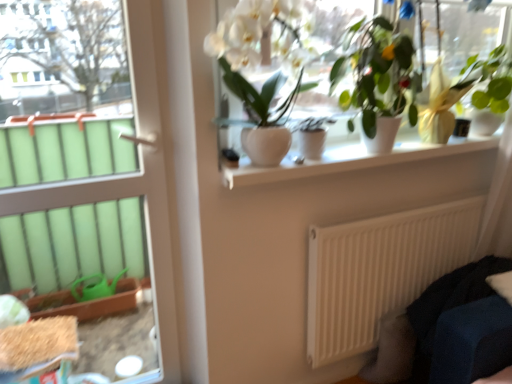
In order to face white matte radiator at lower right, should I rotate leftwards or rightwards?

You should rotate right by 20.667 degrees.

Find the location of a particular element. white matte radiator at lower right is located at coordinates (379, 271).

At what (x,y) coordinates should I click in order to perform the action: click on white glossy vase at upper center, which is counted as the 4th houseplant, starting from the right. Please return your answer as a coordinate pair (x, y). This screenshot has width=512, height=384. Looking at the image, I should click on (257, 65).

How much space does matte white pot at center, acting as the 3th houseplant starting from the right, occupy vertically?

5.70 inches.

The width and height of the screenshot is (512, 384). What do you see at coordinates (312, 136) in the screenshot? I see `matte white pot at center, the second houseplant in the left-to-right sequence` at bounding box center [312, 136].

At what (x,y) coordinates should I click in order to perform the action: click on white glossy door at left. Please return your answer as a coordinate pair (x, y). Looking at the image, I should click on (135, 176).

This screenshot has width=512, height=384. What are the coordinates of `dark blue fabric couch at lower right` in the screenshot? It's located at (428, 322).

Image resolution: width=512 pixels, height=384 pixels. Identify the location of green matte plant at upper center, arranged as the 2th houseplant when viewed from the right. (378, 80).

Locate an element on the screen. The image size is (512, 384). white matte radiator at lower right is located at coordinates (379, 271).

Consider the image. In the image, is matte white pot at center, the second houseplant in the left-to-right sequence, on the left side or the right side of white glossy door at left?

In the image, matte white pot at center, the second houseplant in the left-to-right sequence, appears on the right side of white glossy door at left.

From a real-world perspective, which is physically below, matte white pot at center, the second houseplant in the left-to-right sequence, or white glossy door at left?

white glossy door at left is physically lower.

Is matte white pot at center, the second houseplant in the left-to-right sequence, aimed at white glossy door at left?

No, matte white pot at center, the second houseplant in the left-to-right sequence, is not aimed at white glossy door at left.

Considering the relative positions of matte white pot at center, acting as the 3th houseplant starting from the right, and white glossy door at left in the image provided, is matte white pot at center, acting as the 3th houseplant starting from the right, behind white glossy door at left?

Yes, matte white pot at center, acting as the 3th houseplant starting from the right, is behind white glossy door at left.

Is matte white pot at center, the second houseplant in the left-to-right sequence, facing away from green matte plant at upper center, placed as the third houseplant when sorted from left to right?

That's not correct — matte white pot at center, the second houseplant in the left-to-right sequence, is not looking away from green matte plant at upper center, placed as the third houseplant when sorted from left to right.

In terms of width, does matte white pot at center, acting as the 3th houseplant starting from the right, look wider or thinner when compared to green matte plant at upper center, placed as the third houseplant when sorted from left to right?

In the image, matte white pot at center, acting as the 3th houseplant starting from the right, appears to be more narrow than green matte plant at upper center, placed as the third houseplant when sorted from left to right.

Can you confirm if matte white pot at center, the second houseplant in the left-to-right sequence, is positioned to the right of green matte plant at upper center, arranged as the 2th houseplant when viewed from the right?

Incorrect, matte white pot at center, the second houseplant in the left-to-right sequence, is not on the right side of green matte plant at upper center, arranged as the 2th houseplant when viewed from the right.

From the image's perspective, relative to green matte plant at upper center, arranged as the 2th houseplant when viewed from the right, is matte white pot at center, acting as the 3th houseplant starting from the right, above or below?

matte white pot at center, acting as the 3th houseplant starting from the right, is below green matte plant at upper center, arranged as the 2th houseplant when viewed from the right.

From the image's perspective, relative to green matte plant at upper center, placed as the third houseplant when sorted from left to right, is white matte radiator at lower right above or below?

Based on their image positions, white matte radiator at lower right is located beneath green matte plant at upper center, placed as the third houseplant when sorted from left to right.

Which point is more distant from viewer, (422, 248) or (371, 125)?

The point (422, 248) is behind.

Between white matte radiator at lower right and green matte plant at upper center, placed as the third houseplant when sorted from left to right, which one has smaller size?

green matte plant at upper center, placed as the third houseplant when sorted from left to right.

Does white matte radiator at lower right have a lesser height compared to green matte plant at upper center, arranged as the 2th houseplant when viewed from the right?

No.

At what (x,y) coordinates should I click in order to perform the action: click on houseplant behind the matte white pot at center, acting as the 3th houseplant starting from the right. Please return your answer as a coordinate pair (x, y). This screenshot has height=384, width=512. Looking at the image, I should click on (465, 93).

Which is correct: green glossy plant at upper right, arranged as the first houseplant when viewed from the right, is inside matte white pot at center, acting as the 3th houseplant starting from the right, or outside of it?

green glossy plant at upper right, arranged as the first houseplant when viewed from the right, cannot be found inside matte white pot at center, acting as the 3th houseplant starting from the right.

From a real-world perspective, between green glossy plant at upper right, marked as the fourth houseplant in a left-to-right arrangement, and matte white pot at center, the second houseplant in the left-to-right sequence, who is vertically higher?

From a 3D spatial view, green glossy plant at upper right, marked as the fourth houseplant in a left-to-right arrangement, is above.

From the image's perspective, is green glossy plant at upper right, marked as the fourth houseplant in a left-to-right arrangement, located beneath matte white pot at center, the second houseplant in the left-to-right sequence?

Incorrect, from the image's perspective, green glossy plant at upper right, marked as the fourth houseplant in a left-to-right arrangement, is higher than matte white pot at center, the second houseplant in the left-to-right sequence.

Can we say dark blue fabric couch at lower right lies outside white glossy window sill at upper center?

Indeed, dark blue fabric couch at lower right is completely outside white glossy window sill at upper center.

Considering the relative sizes of dark blue fabric couch at lower right and white glossy window sill at upper center in the image provided, is dark blue fabric couch at lower right bigger than white glossy window sill at upper center?

Indeed, dark blue fabric couch at lower right has a larger size compared to white glossy window sill at upper center.

Find the location of a particular element. The height and width of the screenshot is (384, 512). couch below the white glossy window sill at upper center (from a real-world perspective) is located at coordinates (428, 322).

From a real-world perspective, is dark blue fabric couch at lower right below white glossy window sill at upper center?

Correct, in the physical world, dark blue fabric couch at lower right is lower than white glossy window sill at upper center.

From the image's perspective, between white glossy door at left and green glossy plant at upper right, marked as the fourth houseplant in a left-to-right arrangement, which one is located above?

green glossy plant at upper right, marked as the fourth houseplant in a left-to-right arrangement, is shown above in the image.

Could you tell me if white glossy door at left is turned towards green glossy plant at upper right, arranged as the first houseplant when viewed from the right?

No.

Is white glossy door at left to the left of green glossy plant at upper right, marked as the fourth houseplant in a left-to-right arrangement, from the viewer's perspective?

Indeed, white glossy door at left is positioned on the left side of green glossy plant at upper right, marked as the fourth houseplant in a left-to-right arrangement.

Can you confirm if green matte plant at upper center, placed as the third houseplant when sorted from left to right, is smaller than white glossy vase at upper center, which is counted as the 4th houseplant, starting from the right?

Correct, green matte plant at upper center, placed as the third houseplant when sorted from left to right, occupies less space than white glossy vase at upper center, which is counted as the 4th houseplant, starting from the right.

In the scene shown: Is green matte plant at upper center, placed as the third houseplant when sorted from left to right, next to white glossy vase at upper center, the first houseplant when ordered from left to right?

No, green matte plant at upper center, placed as the third houseplant when sorted from left to right, is not beside white glossy vase at upper center, the first houseplant when ordered from left to right.

How distant is green matte plant at upper center, placed as the third houseplant when sorted from left to right, from white glossy vase at upper center, the first houseplant when ordered from left to right?

The distance of green matte plant at upper center, placed as the third houseplant when sorted from left to right, from white glossy vase at upper center, the first houseplant when ordered from left to right, is 13.37 inches.

In terms of height, does green matte plant at upper center, placed as the third houseplant when sorted from left to right, look taller or shorter compared to white glossy vase at upper center, the first houseplant when ordered from left to right?

green matte plant at upper center, placed as the third houseplant when sorted from left to right, is taller than white glossy vase at upper center, the first houseplant when ordered from left to right.

I want to click on houseplant that is the 2nd one when counting rightward from the white glossy door at left, so click(x=312, y=136).

This screenshot has width=512, height=384. Identify the location of houseplant that is the 1st object located behind the green matte plant at upper center, placed as the third houseplant when sorted from left to right. (312, 136).

Estimate the real-world distances between objects in this image. Which object is further from white glossy vase at upper center, which is counted as the 4th houseplant, starting from the right, white glossy window sill at upper center or white matte radiator at lower right?

Based on the image, white matte radiator at lower right appears to be further to white glossy vase at upper center, which is counted as the 4th houseplant, starting from the right.

From the image, which object appears to be farther from green matte plant at upper center, placed as the third houseplant when sorted from left to right, white glossy door at left or matte white pot at center, the second houseplant in the left-to-right sequence?

white glossy door at left.

Which object lies further to the anchor point green matte plant at upper center, arranged as the 2th houseplant when viewed from the right, white glossy door at left or white glossy vase at upper center, which is counted as the 4th houseplant, starting from the right?

white glossy door at left is further to green matte plant at upper center, arranged as the 2th houseplant when viewed from the right.

In the scene shown: From the image, which object appears to be nearer to white glossy door at left, dark blue fabric couch at lower right or green glossy plant at upper right, arranged as the first houseplant when viewed from the right?

dark blue fabric couch at lower right is positioned closer to the anchor white glossy door at left.

Estimate the real-world distances between objects in this image. Which object is further from dark blue fabric couch at lower right, matte white pot at center, the second houseplant in the left-to-right sequence, or white glossy vase at upper center, which is counted as the 4th houseplant, starting from the right?

white glossy vase at upper center, which is counted as the 4th houseplant, starting from the right, lies further to dark blue fabric couch at lower right than the other object.

From the image, which object appears to be nearer to matte white pot at center, acting as the 3th houseplant starting from the right, white glossy window sill at upper center or white glossy vase at upper center, the first houseplant when ordered from left to right?

white glossy window sill at upper center lies closer to matte white pot at center, acting as the 3th houseplant starting from the right, than the other object.

Based on their spatial positions, is white glossy vase at upper center, the first houseplant when ordered from left to right, or white glossy door at left further from matte white pot at center, acting as the 3th houseplant starting from the right?

white glossy door at left lies further to matte white pot at center, acting as the 3th houseplant starting from the right, than the other object.

When comparing their distances from dark blue fabric couch at lower right, does green matte plant at upper center, arranged as the 2th houseplant when viewed from the right, or white glossy door at left seem closer?

green matte plant at upper center, arranged as the 2th houseplant when viewed from the right, lies closer to dark blue fabric couch at lower right than the other object.

Locate an element on the screen. window sill that lies between matte white pot at center, acting as the 3th houseplant starting from the right, and white matte radiator at lower right from top to bottom is located at coordinates (352, 159).

Locate an element on the screen. The width and height of the screenshot is (512, 384). radiator located between white glossy door at left and green glossy plant at upper right, marked as the fourth houseplant in a left-to-right arrangement, in the left-right direction is located at coordinates (379, 271).

Locate an element on the screen. The image size is (512, 384). window sill between green matte plant at upper center, placed as the third houseplant when sorted from left to right, and dark blue fabric couch at lower right, in the vertical direction is located at coordinates (352, 159).

The width and height of the screenshot is (512, 384). I want to click on window sill between white glossy door at left and white matte radiator at lower right in the horizontal direction, so click(352, 159).